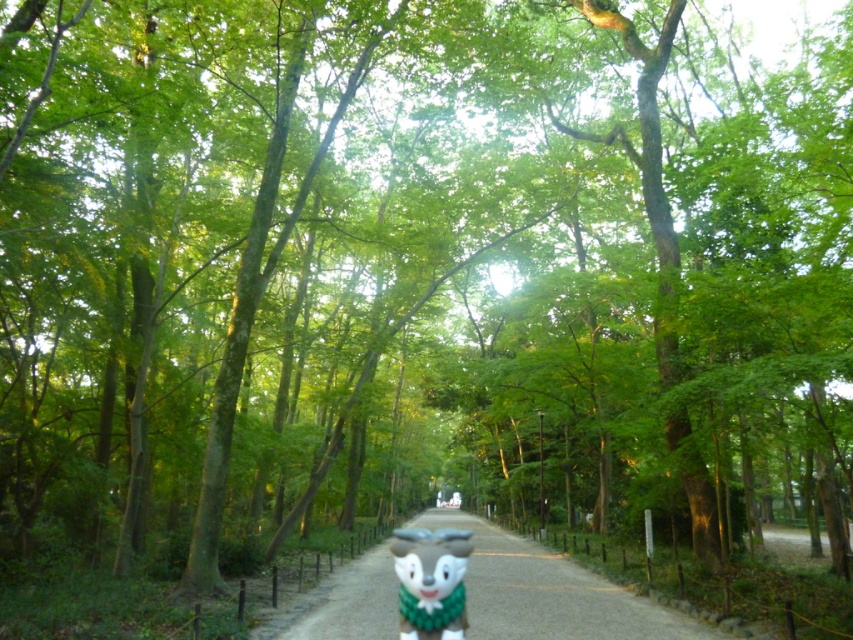
Question: Considering the relative positions of smooth gravel path at center and green plush toy at center in the image provided, where is smooth gravel path at center located with respect to green plush toy at center?

Choices:
 (A) right
 (B) left

Answer: (A)

Question: Where is smooth gravel path at center located in relation to green plush toy at center in the image?

Choices:
 (A) left
 (B) right

Answer: (B)

Question: From the image, what is the correct spatial relationship of smooth gravel path at center in relation to green plush toy at center?

Choices:
 (A) right
 (B) left

Answer: (A)